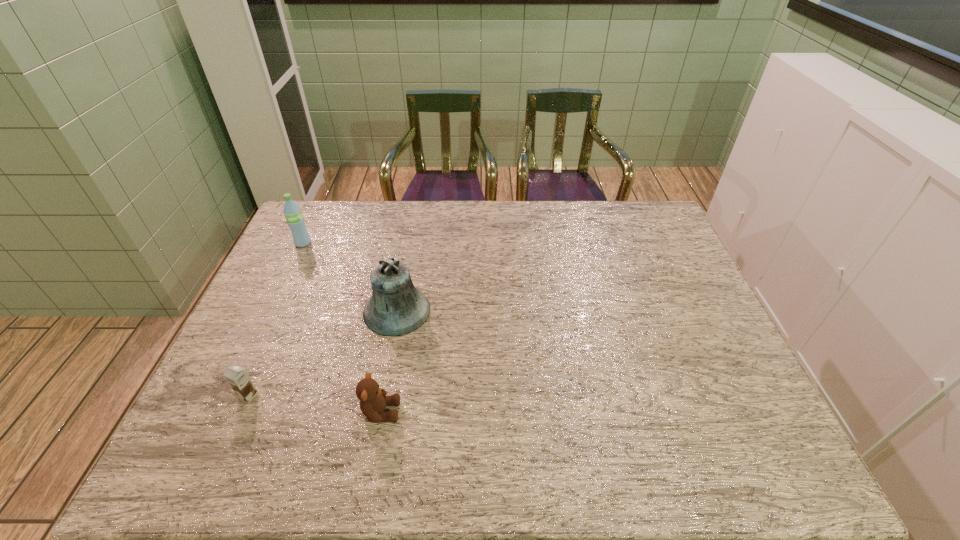
Locate an element on the screen. The image size is (960, 540). water bottle is located at coordinates (295, 220).

Find the location of `the second farthest object`. the second farthest object is located at coordinates (395, 308).

What are the coordinates of `teddy bear` in the screenshot? It's located at (373, 400).

What are the coordinates of `chocolate milk` in the screenshot? It's located at (237, 378).

Locate an element on the screen. The width and height of the screenshot is (960, 540). free spot located on the right of the water bottle is located at coordinates (403, 243).

Find the location of a particular element. This screenshot has height=540, width=960. vacant region located on the front of the second farthest object is located at coordinates (385, 374).

At what (x,y) coordinates should I click in order to perform the action: click on blank area located 0.290m on the face of the teddy bear. Please return your answer as a coordinate pair (x, y). Looking at the image, I should click on (525, 412).

In order to click on vacant space located 0.060m on the right of the chocolate milk in this screenshot , I will do `click(282, 395)`.

Find the location of `object at the far edge`. object at the far edge is located at coordinates (295, 220).

At what (x,y) coordinates should I click in order to perform the action: click on water bottle that is at the left edge. Please return your answer as a coordinate pair (x, y). Looking at the image, I should click on (295, 220).